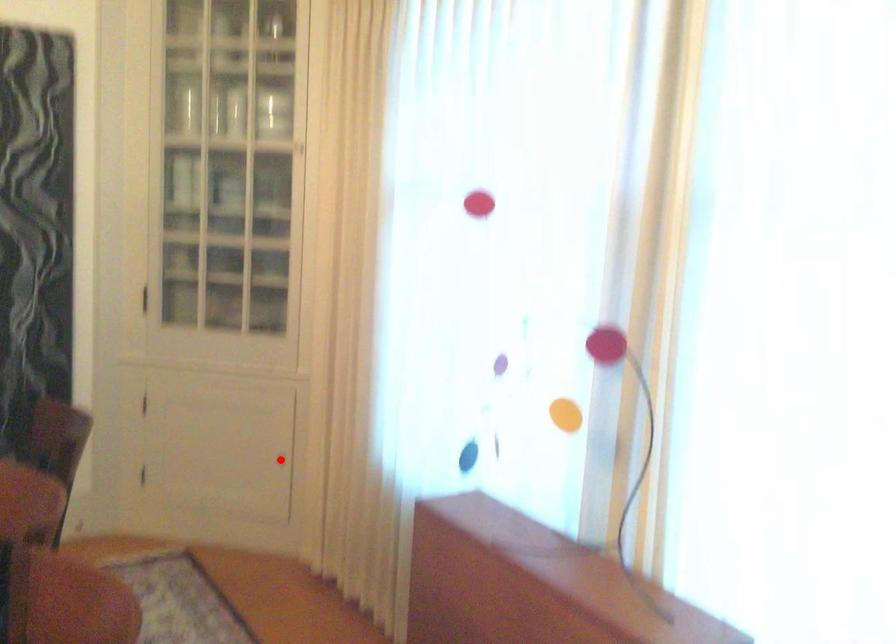
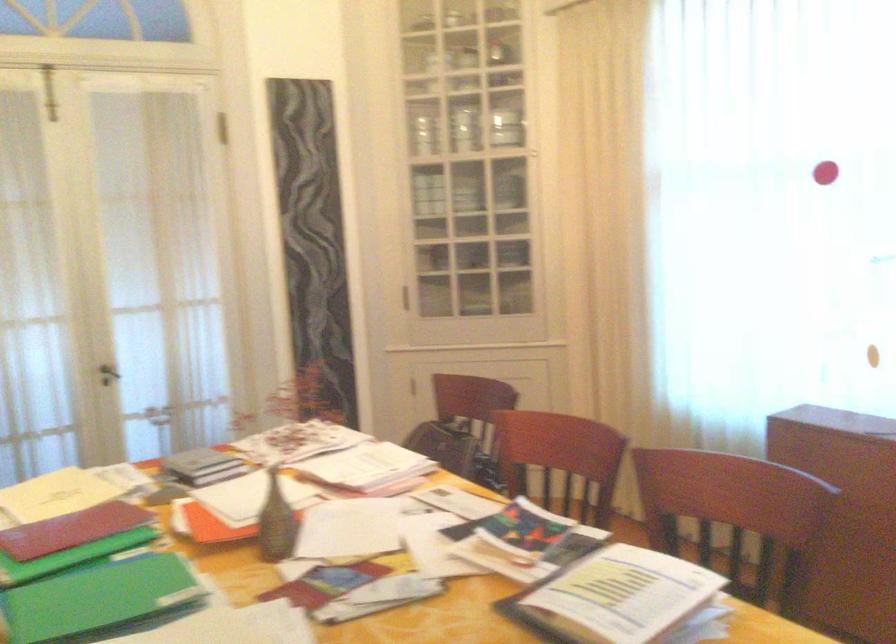
Question: I am providing you with two images of the same scene from different viewpoints. A red point is marked on the first image. Can you still see the location of the red point in image 2?

Choices:
 (A) Yes
 (B) No

Answer: (B)